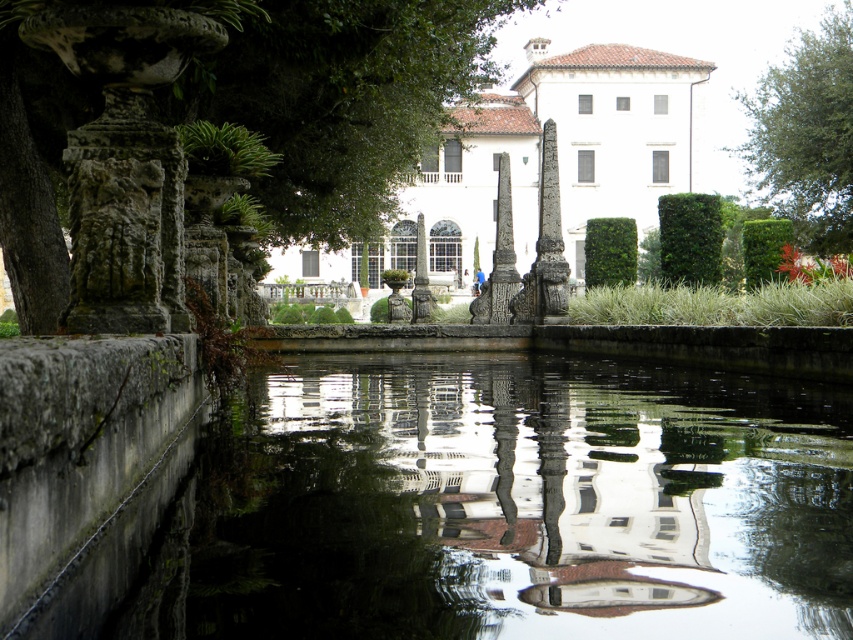
Question: Among these points, which one is farthest from the camera?

Choices:
 (A) (339, 579)
 (B) (73, 83)

Answer: (B)

Question: Which of the following is the closest to the observer?

Choices:
 (A) (20, 179)
 (B) (421, 525)
 (C) (805, 106)

Answer: (B)

Question: Does smooth concrete water at center appear on the right side of green leafy tree at left?

Choices:
 (A) no
 (B) yes

Answer: (B)

Question: Can you confirm if smooth concrete water at center is positioned below green leafy tree at upper right?

Choices:
 (A) no
 (B) yes

Answer: (B)

Question: Is green leafy tree at left to the left of green leafy tree at upper right from the viewer's perspective?

Choices:
 (A) no
 (B) yes

Answer: (B)

Question: Which of the following is the farthest from the observer?

Choices:
 (A) green leafy tree at left
 (B) smooth concrete water at center
 (C) green leafy tree at upper right

Answer: (C)